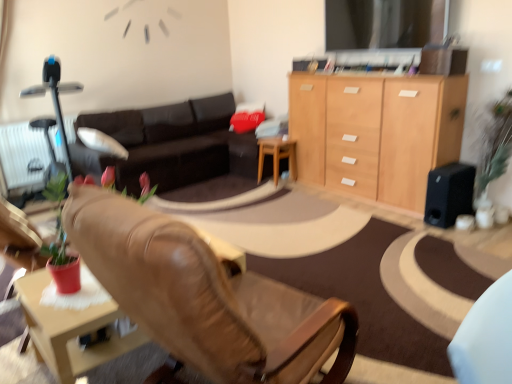
Locate an element on the screen. free space in front of black matte speaker at right is located at coordinates (457, 231).